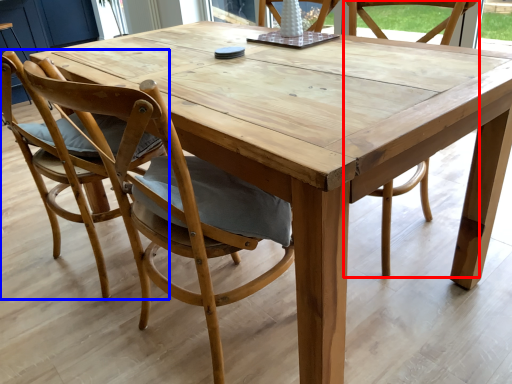
Question: Among these objects, which one is farthest to the camera, chair (highlighted by a red box) or chair (highlighted by a blue box)?

Choices:
 (A) chair
 (B) chair

Answer: (A)